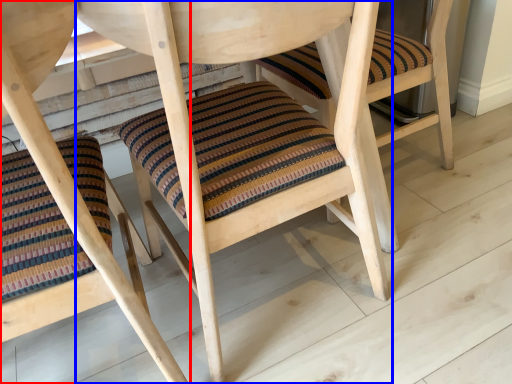
Question: Which object appears closest to the camera in this image, chair (highlighted by a red box) or chair (highlighted by a blue box)?

Choices:
 (A) chair
 (B) chair

Answer: (A)